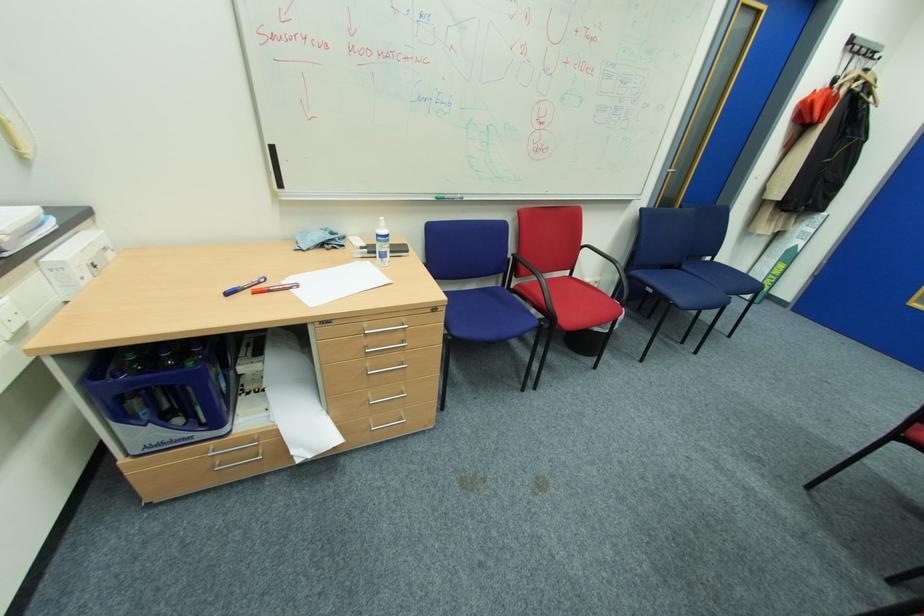
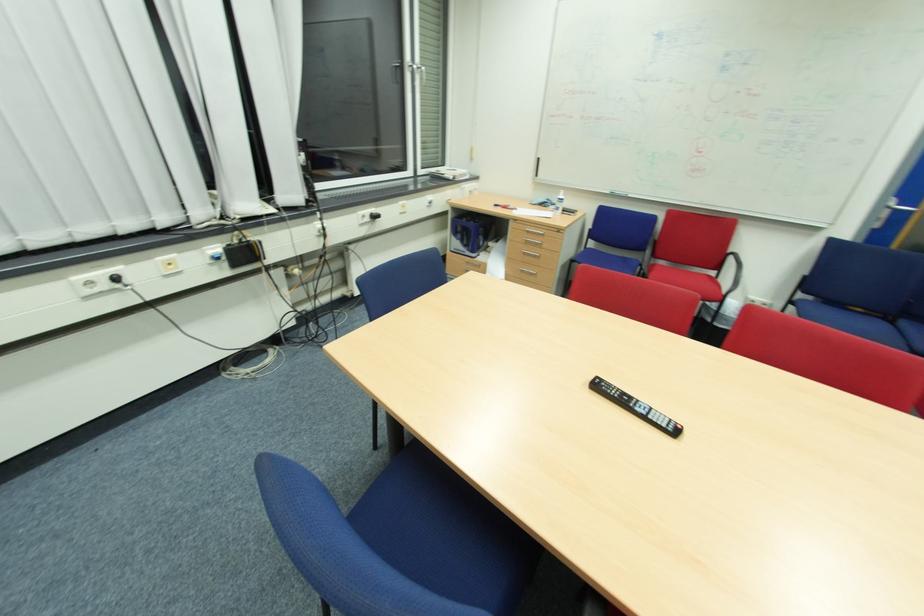
Where in the second image is the point corresponding to (382,227) from the first image?

(564, 195)